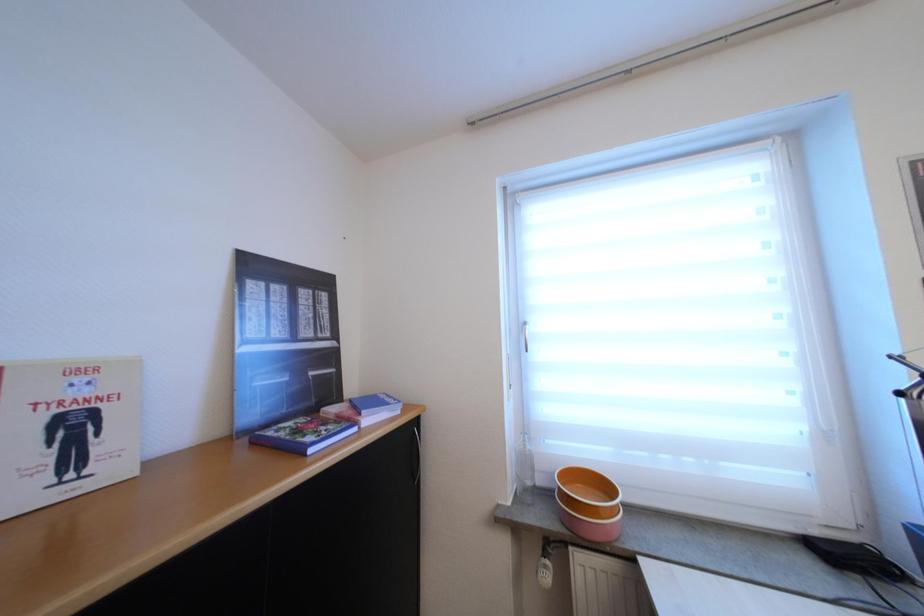
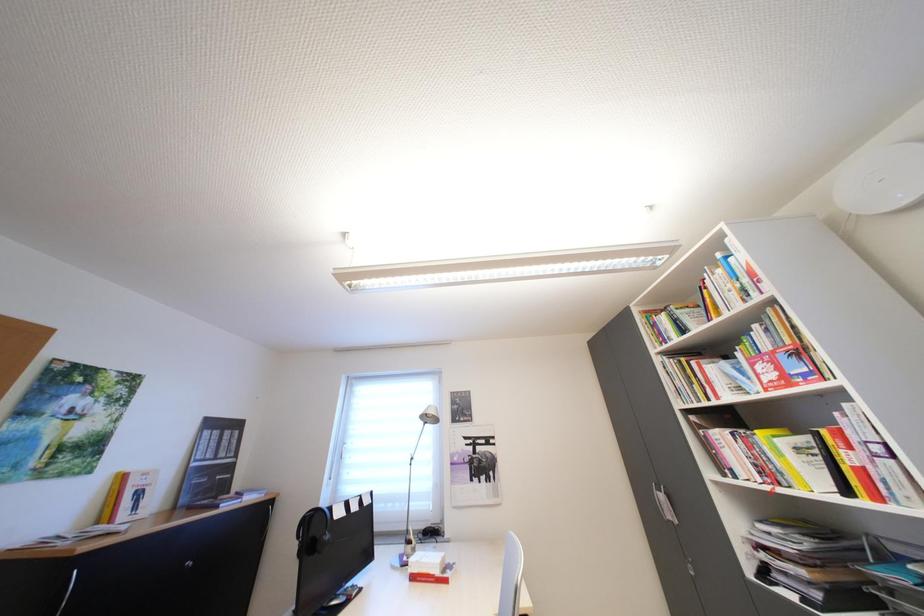
Question: Which direction would the cameraman need to move to produce the second image? Reply with the corresponding letter.

Choices:
 (A) Left
 (B) Right
 (C) Forward
 (D) Backward

Answer: (D)